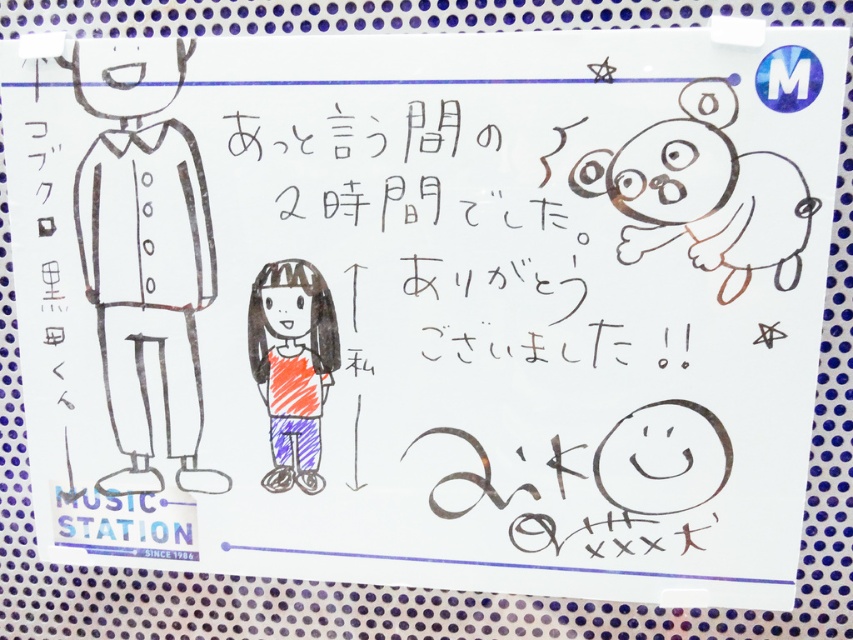
Question: Which point is closer to the camera?

Choices:
 (A) (106, 132)
 (B) (318, 429)

Answer: (A)

Question: In this image, where is black line art figure at left located relative to orange crayon girl at center?

Choices:
 (A) above
 (B) below

Answer: (A)

Question: Is black line art figure at left bigger than orange crayon girl at center?

Choices:
 (A) no
 (B) yes

Answer: (B)

Question: Which point is farther to the camera?

Choices:
 (A) orange crayon girl at center
 (B) black line art figure at left

Answer: (A)

Question: Which of the following is the closest to the observer?

Choices:
 (A) (305, 454)
 (B) (111, 202)

Answer: (B)

Question: Is black line art figure at left positioned in front of orange crayon girl at center?

Choices:
 (A) yes
 (B) no

Answer: (A)